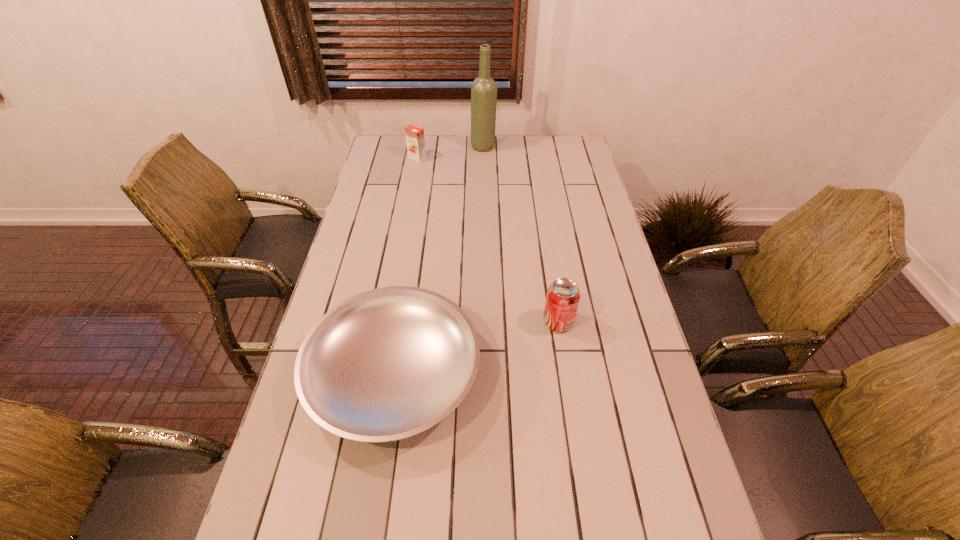
You are a GUI agent. You are given a task and a screenshot of the screen. Output one action in this format:
    pyautogui.click(x=<x>, y=<y>)
    Task: Click on the vacant space in between the orange juice and the shortest object
    
    Given the screenshot: What is the action you would take?
    pyautogui.click(x=405, y=265)

Identify the location of empty space that is in between the shortest object and the tallest object. (439, 260).

Identify which object is the nearest to the rightmost object. Please provide its 2D coordinates. Your answer should be formatted as a tuple, i.e. [(x, y)], where the tuple contains the x and y coordinates of a point satisfying the conditions above.

[(386, 364)]

You are a GUI agent. You are given a task and a screenshot of the screen. Output one action in this format:
    pyautogui.click(x=<x>, y=<y>)
    Task: Click on the object that is the second closest to the rightmost object
    Image resolution: width=960 pixels, height=540 pixels.
    Given the screenshot: What is the action you would take?
    pyautogui.click(x=484, y=89)

You are a GUI agent. You are given a task and a screenshot of the screen. Output one action in this format:
    pyautogui.click(x=<x>, y=<y>)
    Task: Click on the vacant point that satisfies the following two spatial constraints: 1. on the back side of the bedpan; 2. on the right side of the soda can
    
    Given the screenshot: What is the action you would take?
    pyautogui.click(x=402, y=322)

In order to click on vacant region that satisfies the following two spatial constraints: 1. on the back side of the wine bottle; 2. on the right side of the bedpan in this screenshot , I will do `click(429, 147)`.

Find the location of a particular element. Image resolution: width=960 pixels, height=540 pixels. blank area in the image that satisfies the following two spatial constraints: 1. on the back side of the shortest object; 2. on the left side of the rightmost object is located at coordinates (402, 322).